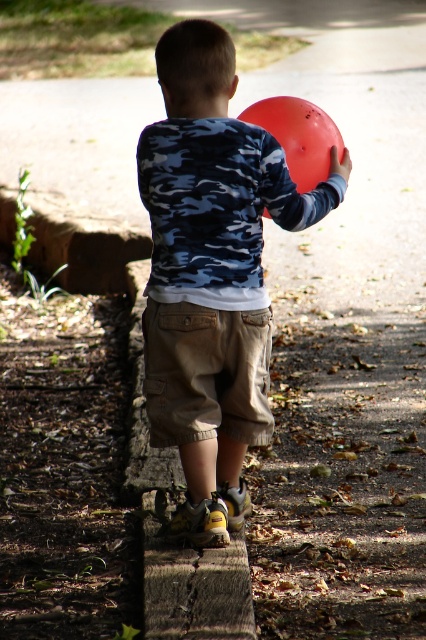
You are a photographer trying to capture a shot of the child holding the balloon. You are standing at the starting point and see the matte blue camouflage shirt at center and the brown wood curb at lower center. Which object is closer to you?

The matte blue camouflage shirt at center is closer to you because the brown wood curb at lower center is behind it.

You are a photographer trying to capture the khaki cotton shorts at center and the brown wood curb at lower center in a single frame. Based on their widths, which object will appear wider in the photo?

The brown wood curb at lower center will appear wider in the photo since its width surpasses that of the khaki cotton shorts at center.

You are standing at the camera position and want to place a 3 meter long fence post between the brown wood curb at lower center and the camera. Is there enough space?

The distance between the brown wood curb at lower center and the camera is 3.07 meters. Since the fence post is 3 meters long, there is enough space to place it between them.